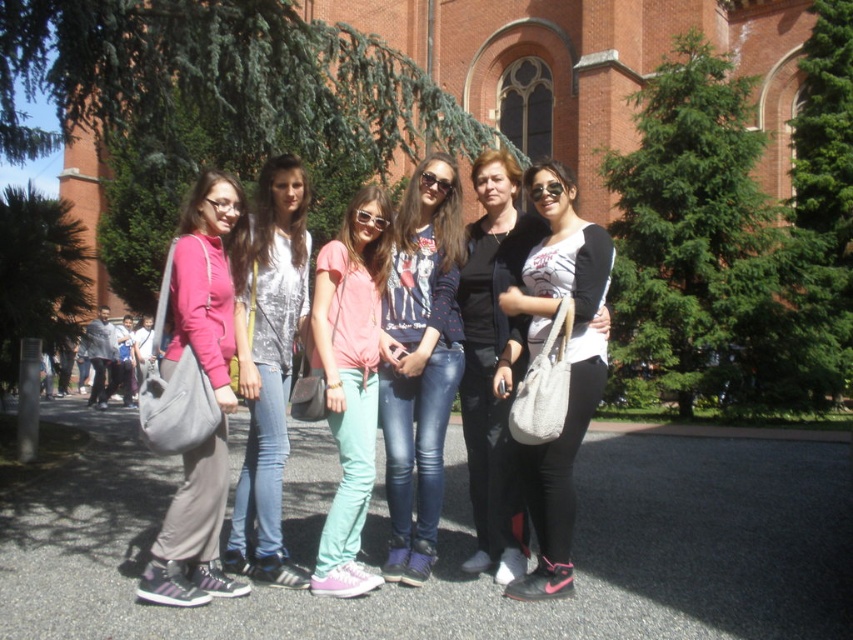
Question: Which point is farther to the camera?

Choices:
 (A) black matte jacket at center
 (B) pink matte t-shirt at center

Answer: (A)

Question: Is polka dot sweater at center thinner than pink matte t-shirt at center?

Choices:
 (A) no
 (B) yes

Answer: (A)

Question: Which object appears farthest from the camera in this image?

Choices:
 (A) shiny silver top at center
 (B) white matte bag at center

Answer: (A)

Question: Can you confirm if polka dot sweater at center is smaller than pink matte t-shirt at center?

Choices:
 (A) no
 (B) yes

Answer: (A)

Question: Considering the real-world distances, which object is closest to the black matte jacket at center?

Choices:
 (A) matte pink hoodie at left
 (B) polka dot sweater at center
 (C) shiny silver top at center
 (D) white matte bag at center

Answer: (D)

Question: Does shiny silver top at center come behind black matte jacket at center?

Choices:
 (A) yes
 (B) no

Answer: (B)